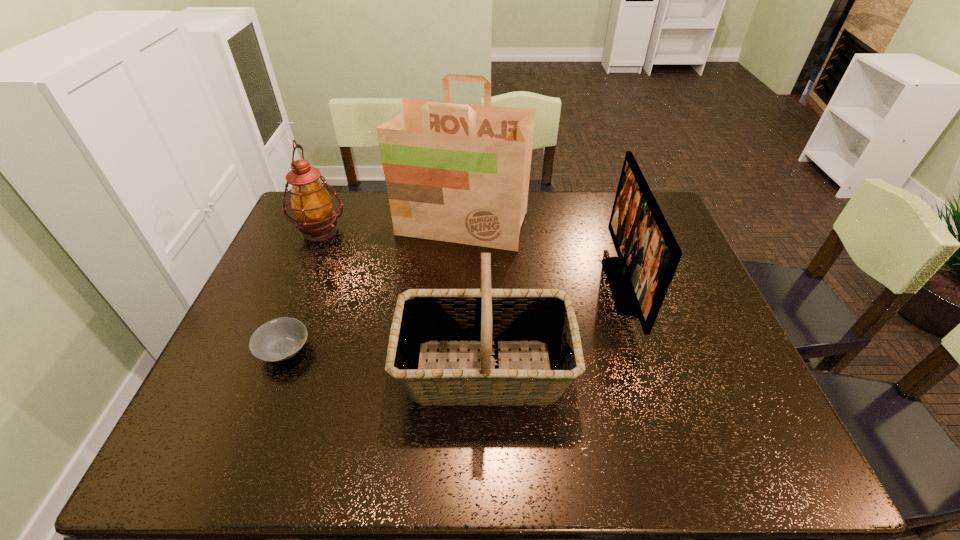
The width and height of the screenshot is (960, 540). I want to click on the tallest object, so click(x=459, y=173).

Where is `oil lamp`? The image size is (960, 540). oil lamp is located at coordinates [x=312, y=205].

Where is `the rightmost object`? The image size is (960, 540). the rightmost object is located at coordinates (648, 254).

Where is `basket`? This screenshot has height=540, width=960. basket is located at coordinates (490, 319).

The image size is (960, 540). In order to click on the shortest object in this screenshot , I will do `click(279, 339)`.

Identify the location of free space located 0.280m on the front of the tallest object. (458, 322).

This screenshot has width=960, height=540. Find the location of `vacant position located 0.280m on the front of the oil lamp`. vacant position located 0.280m on the front of the oil lamp is located at coordinates (284, 319).

I want to click on free point located 0.220m on the front-facing side of the monitor, so click(531, 286).

Find the location of a particular element. This screenshot has height=540, width=960. vacant area situated on the front-facing side of the monitor is located at coordinates (563, 286).

The width and height of the screenshot is (960, 540). I want to click on free space located on the front-facing side of the monitor, so click(523, 286).